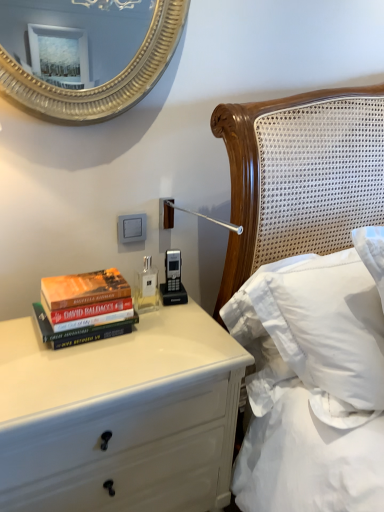
Question: Does hardcover books at left have a smaller size compared to white soft pillow at upper right?

Choices:
 (A) no
 (B) yes

Answer: (B)

Question: Is hardcover books at left to the left of white soft pillow at upper right from the viewer's perspective?

Choices:
 (A) yes
 (B) no

Answer: (A)

Question: Considering the relative positions of hardcover books at left and white soft pillow at upper right in the image provided, is hardcover books at left to the right of white soft pillow at upper right from the viewer's perspective?

Choices:
 (A) yes
 (B) no

Answer: (B)

Question: Can you confirm if hardcover books at left is bigger than white soft pillow at upper right?

Choices:
 (A) no
 (B) yes

Answer: (A)

Question: From the image's perspective, does hardcover books at left appear higher than white soft pillow at upper right?

Choices:
 (A) yes
 (B) no

Answer: (A)

Question: Could you tell me if hardcover books at left is turned towards white soft pillow at upper right?

Choices:
 (A) no
 (B) yes

Answer: (A)

Question: Can you confirm if hardcover books at left is shorter than white glossy chest of drawers at lower left?

Choices:
 (A) no
 (B) yes

Answer: (B)

Question: Is hardcover books at left completely or partially outside of white glossy chest of drawers at lower left?

Choices:
 (A) yes
 (B) no

Answer: (A)

Question: Does hardcover books at left have a smaller size compared to white glossy chest of drawers at lower left?

Choices:
 (A) yes
 (B) no

Answer: (A)

Question: From the image's perspective, would you say hardcover books at left is positioned over white glossy chest of drawers at lower left?

Choices:
 (A) no
 (B) yes

Answer: (B)

Question: Is hardcover books at left positioned before white glossy chest of drawers at lower left?

Choices:
 (A) no
 (B) yes

Answer: (A)

Question: Considering the relative positions of hardcover books at left and white glossy chest of drawers at lower left in the image provided, is hardcover books at left to the left of white glossy chest of drawers at lower left from the viewer's perspective?

Choices:
 (A) no
 (B) yes

Answer: (B)

Question: Is the surface of hardcover books at left in direct contact with clear glass bottle at center?

Choices:
 (A) yes
 (B) no

Answer: (B)